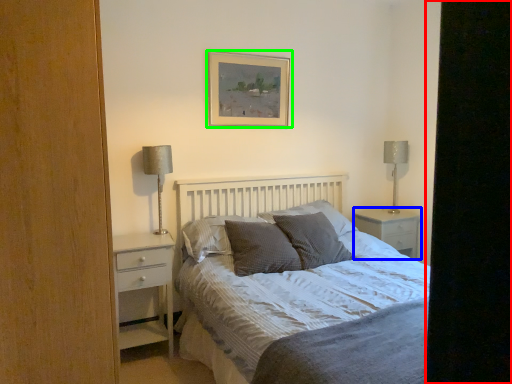
Question: Which object is the farthest from screen door (highlighted by a red box)? Choose among these: nightstand (highlighted by a blue box) or picture frame (highlighted by a green box).

Choices:
 (A) nightstand
 (B) picture frame

Answer: (A)